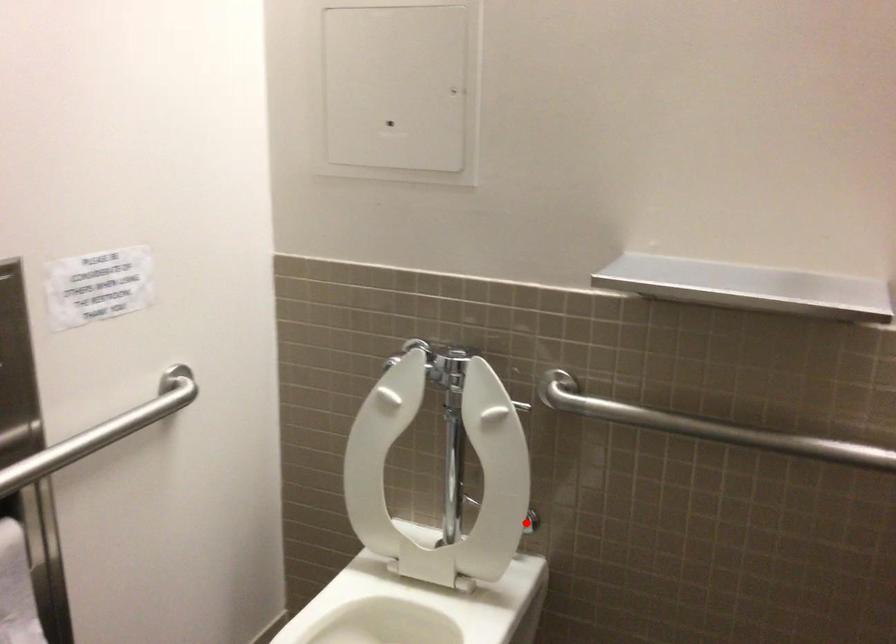
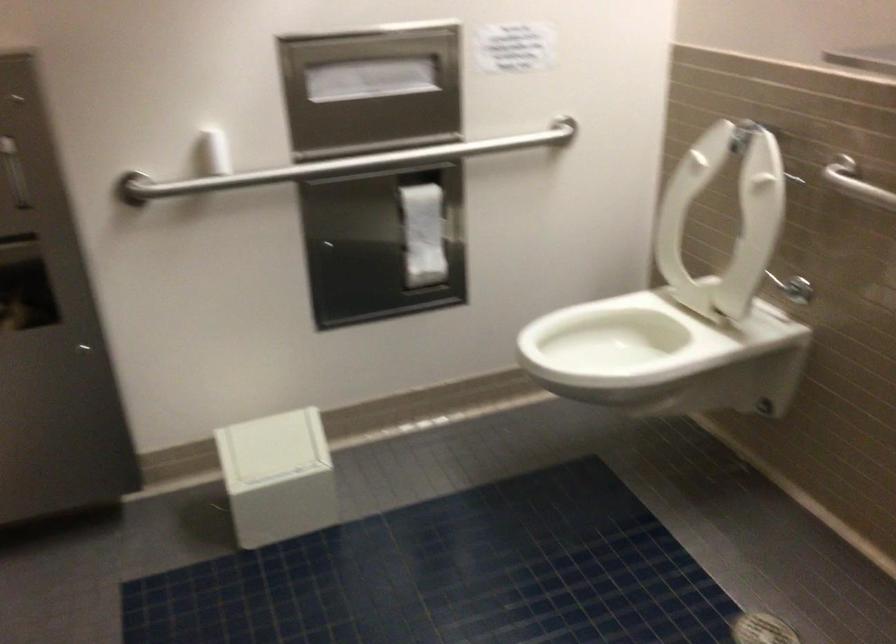
Question: I am providing you with two images of the same scene from different viewpoints. A red point is shown in image1. For the corresponding object point in image2, is it positioned nearer or farther from the camera?

Choices:
 (A) Nearer
 (B) Farther

Answer: (B)